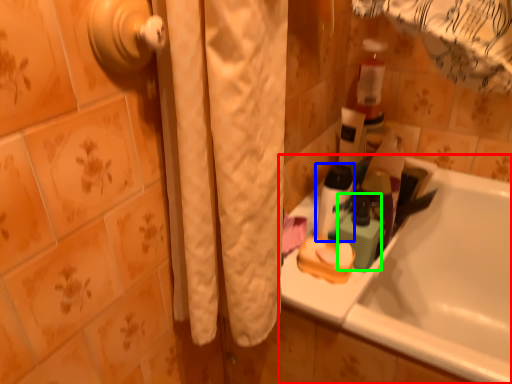
Question: Which is farther away from bathtub (highlighted by a red box)? toiletry (highlighted by a blue box) or mouthwash (highlighted by a green box)?

Choices:
 (A) toiletry
 (B) mouthwash

Answer: (A)